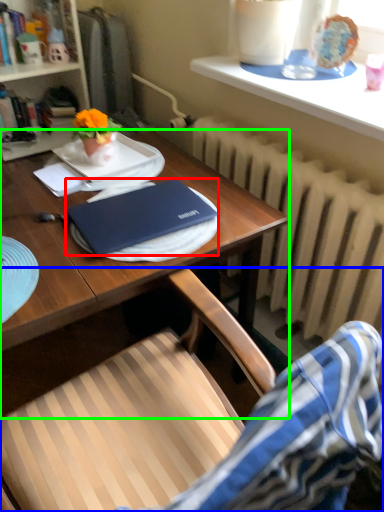
Question: Considering the real-world distances, which object is closest to laptop (highlighted by a red box)? chair (highlighted by a blue box) or desk (highlighted by a green box).

Choices:
 (A) chair
 (B) desk

Answer: (B)